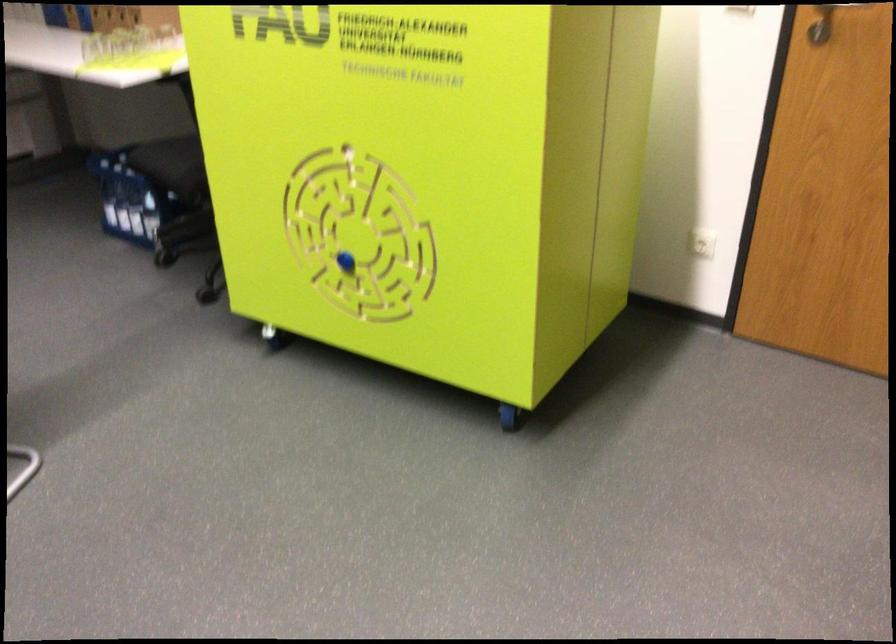
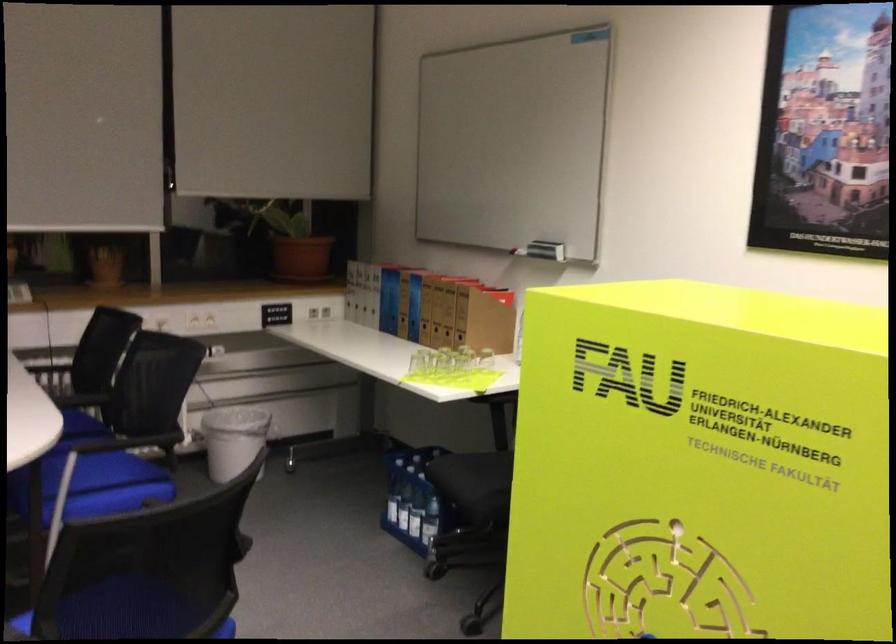
Where in the second image is the point corresponding to (125,205) from the first image?

(403, 507)